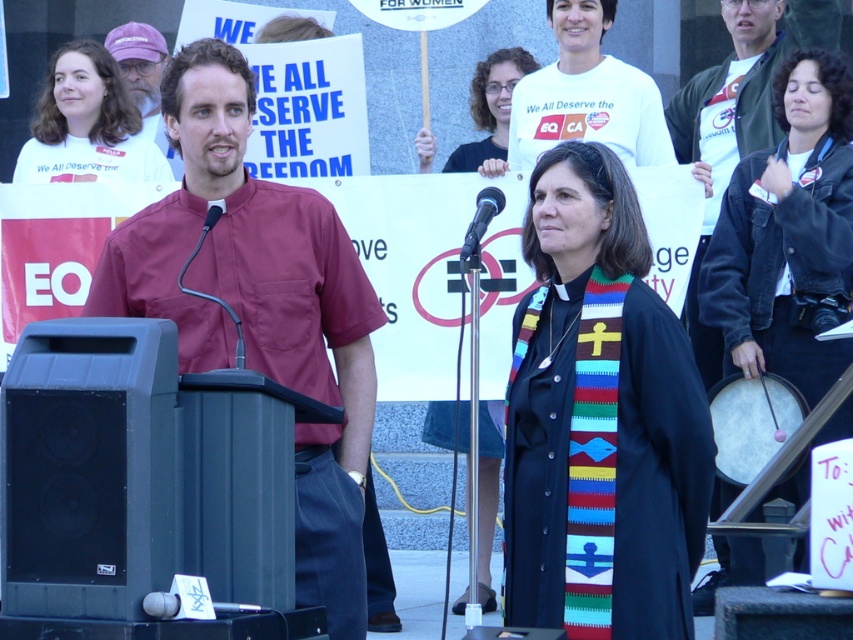
You are a photographer at the protest event. You want to capture a photo that includes both the black plastic speaker at lower left and the black plastic microphone at center. Based on their positions, which object should you focus on first to ensure both are in frame?

Answer: The black plastic speaker at lower left is below the black plastic microphone at center, so you should focus on the microphone at center first to ensure both are in frame.

You are organizing a rally and need to position a new microphone stand between the black plastic speaker at lower left and the podium. Based on their positions, where should you place the microphone stand to ensure it is equidistant from both objects?

The black plastic speaker at lower left is located at point (x=88, y=467). To place the microphone stand equidistant from both, calculate the midpoint between the speaker and the podium. However, since the podium is at an unknown coordinate, additional information is needed to determine the exact position.

In the scene shown: You are a photographer trying to capture the purple fabric cap at upper left in your shot. Based on its position, where should you aim your camera?

The purple fabric cap at upper left is located at the 2D coordinates point (144, 77), so aim your camera towards that position to capture it.